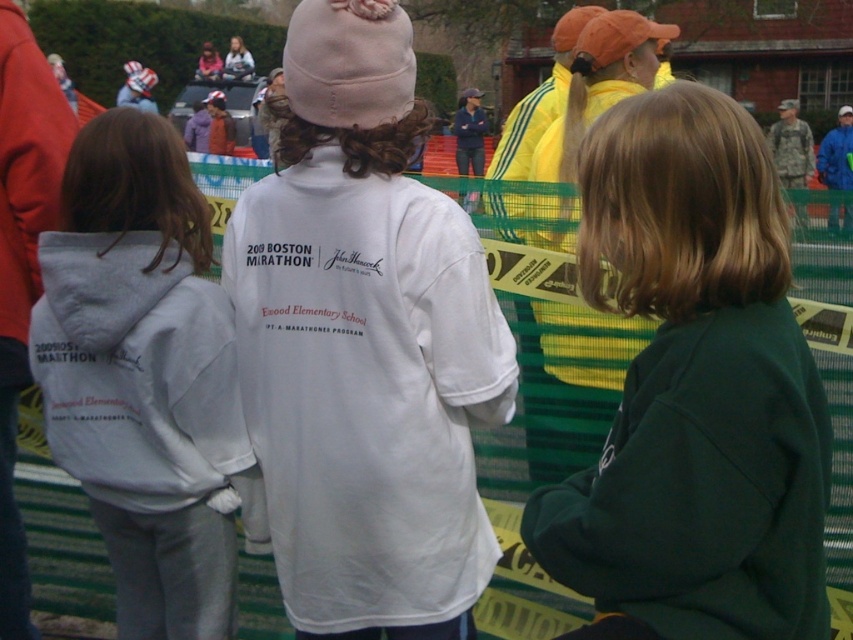
Between point (451, 369) and point (231, 74), which one is positioned behind?

Point (231, 74)

Measure the distance between white cotton sweatshirt at center and camera.

white cotton sweatshirt at center and camera are 9.97 feet apart.

Locate an element on the screen. white cotton sweatshirt at center is located at coordinates (367, 390).

Can you confirm if gray fleece sweatshirt at center is positioned to the left of blue fabric jacket at upper right?

Correct, you'll find gray fleece sweatshirt at center to the left of blue fabric jacket at upper right.

Who is more distant from viewer, [225,461] or [846,152]?

Point [846,152]

The height and width of the screenshot is (640, 853). I want to click on gray fleece sweatshirt at center, so point(136,372).

Identify the location of gray fleece sweatshirt at center. (136, 372).

Who is higher up, dark green sweatshirt at center or blue fabric jacket at upper right?

blue fabric jacket at upper right is above.

Is point (665, 193) positioned in front of point (840, 116)?

That is True.

Locate an element on the screen. Image resolution: width=853 pixels, height=640 pixels. dark green sweatshirt at center is located at coordinates (693, 390).